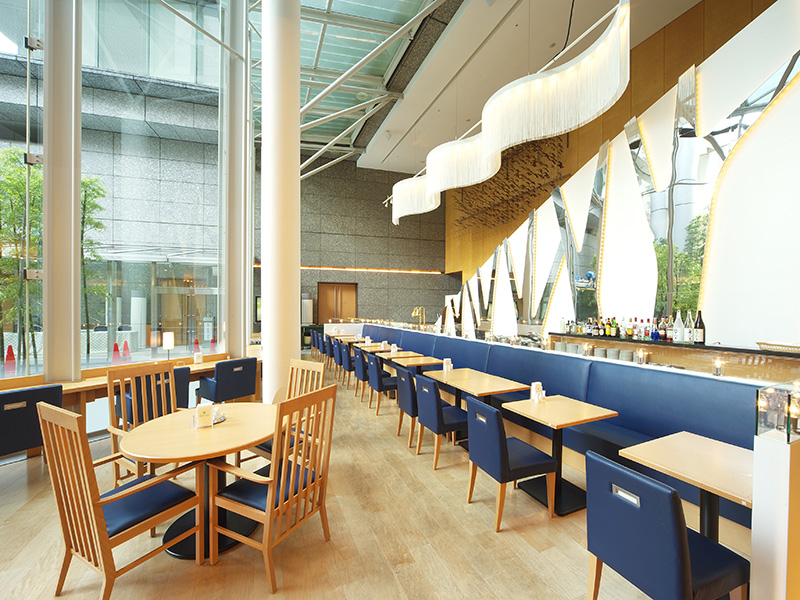
Where is `chair seats`? This screenshot has height=600, width=800. chair seats is located at coordinates (712, 561), (513, 453), (450, 412), (389, 381), (384, 371), (353, 362), (366, 372), (254, 489), (266, 444), (134, 501).